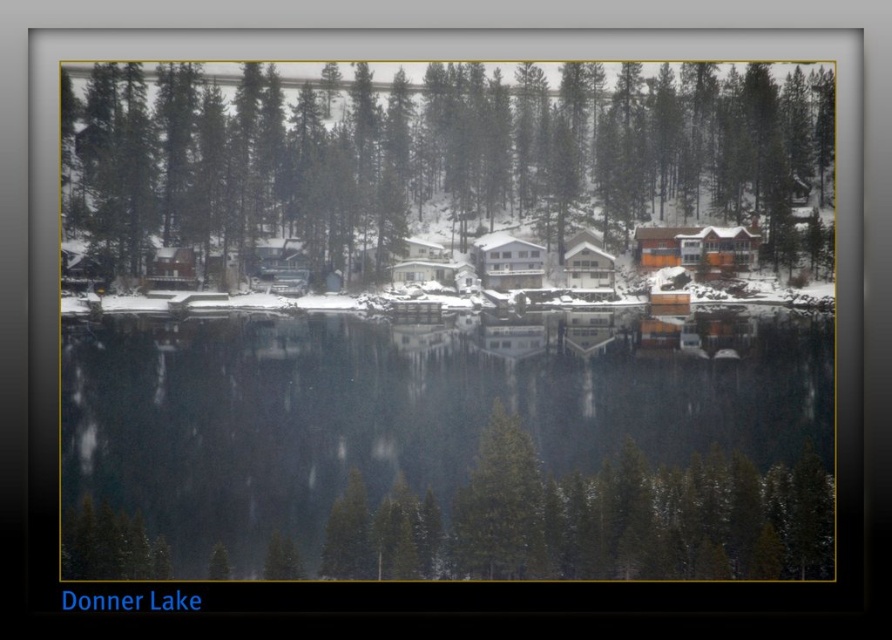
Question: Does clear water at center appear on the left side of green matte trees at center?

Choices:
 (A) yes
 (B) no

Answer: (B)

Question: Does clear water at center have a greater width compared to green matte trees at center?

Choices:
 (A) no
 (B) yes

Answer: (A)

Question: Which point is farther to the camera?

Choices:
 (A) (820, 106)
 (B) (659, 410)

Answer: (A)

Question: Can you confirm if clear water at center is bigger than green matte trees at center?

Choices:
 (A) yes
 (B) no

Answer: (B)

Question: Among these points, which one is nearest to the camera?

Choices:
 (A) (577, 113)
 (B) (791, 531)

Answer: (B)